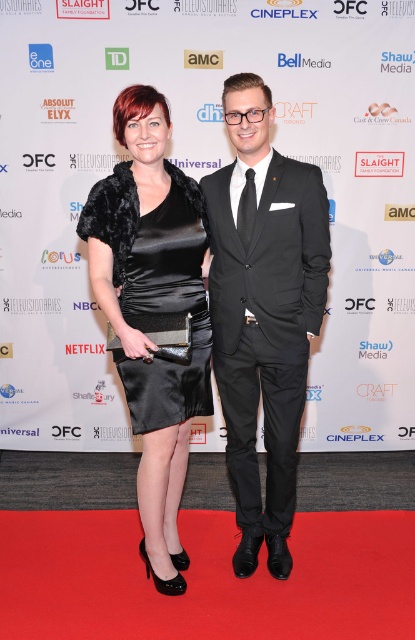
You are a photographer at the event and need to capture a photo where both the matte black suit at center and the satin black dress at center are clearly visible. Based on their positions, which one should you focus on first to ensure both are in frame?

Since the matte black suit at center is positioned on the right side of the satin black dress at center, you should focus on the satin black dress at center first to ensure both are in frame.

You are standing at the camera position and want to take a photo of the point at coordinates (212, 204). The camera has a minimum focus distance of 5 feet. Will the point be in focus?

The point at coordinates (212, 204) is 6.93 feet away from the camera, which is beyond the minimum focus distance of 5 feet. Therefore, the point will be in focus.